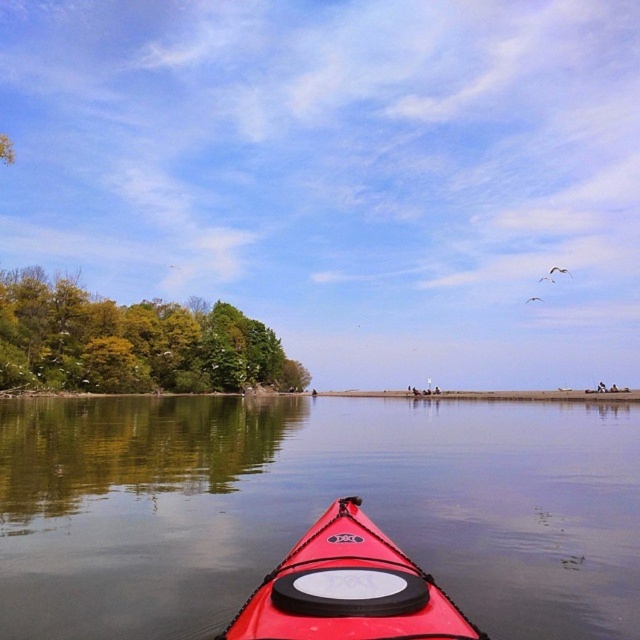
You are planning to take a photo from the kayak. The red plastic kayak at center and the green leafy trees at left are in your view. Which object is wider in the photo?

The red plastic kayak at center is wider than the green leafy trees at left in the photo.

You are in a red kayak and want to reach a specific location on the water. You see two points marked as point 1 and point 2. Point 1 is at coordinates point (252, 321) and point 2 is at coordinates point (289, 561). Which point is closer to your current position in the kayak?

Point 1 is closer to your current position in the kayak because it is further to the camera than point 2, meaning it is physically nearer to you.

You are in a red kayak and want to know the distance to the point at coordinates point [618,470]. Can you reach it by paddling straight ahead without getting out of the kayak?

The point at coordinates point [618,470] is 107.95 feet away from the camera. Since the kayak is a watercraft designed for paddling, it is possible to reach the point by paddling straight ahead without leaving the kayak, provided there are no obstacles in the way.